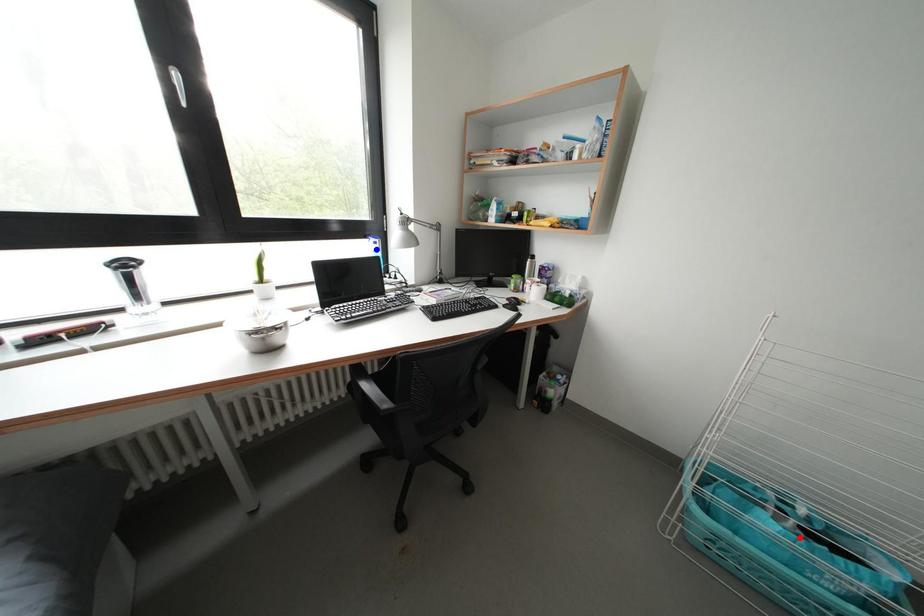
Question: Two points are marked on the image. Which point is closer to the camera?

Choices:
 (A) Blue point is closer.
 (B) Red point is closer.

Answer: (B)